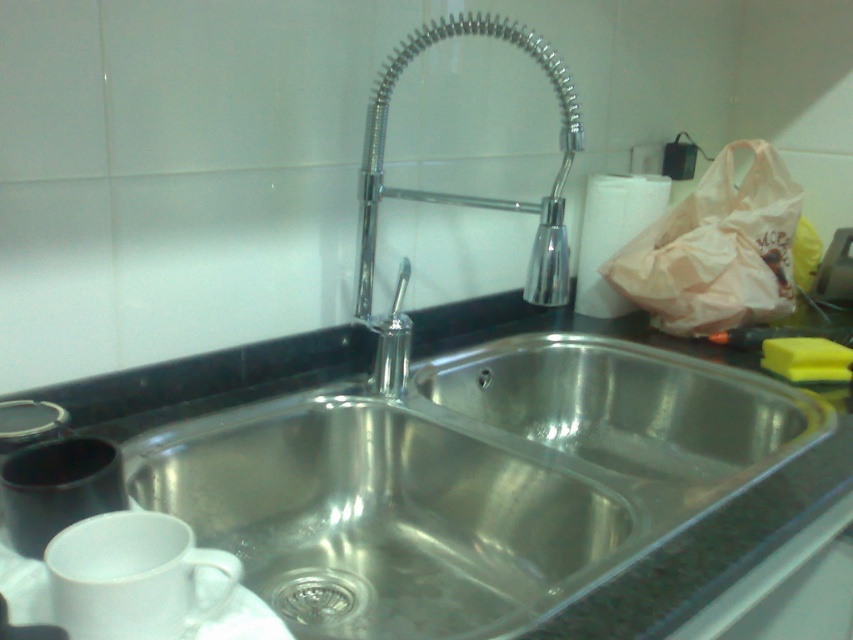
Question: Is stainless steel sink at center smaller than brushed metal drain at center?

Choices:
 (A) no
 (B) yes

Answer: (A)

Question: Which object appears farthest from the camera in this image?

Choices:
 (A) brushed metal drain at center
 (B) chrome/metallic faucet at center
 (C) stainless steel sink at center

Answer: (A)

Question: Is stainless steel sink at center smaller than brushed metal drain at center?

Choices:
 (A) no
 (B) yes

Answer: (A)

Question: Which object appears farthest from the camera in this image?

Choices:
 (A) brushed metal drain at center
 (B) chrome/metallic faucet at center
 (C) stainless steel sink at center

Answer: (A)

Question: Which object is closer to the camera taking this photo?

Choices:
 (A) chrome/metallic faucet at center
 (B) brushed metal drain at center
 (C) stainless steel sink at center

Answer: (C)

Question: Does chrome/metallic faucet at center lie in front of brushed metal drain at center?

Choices:
 (A) yes
 (B) no

Answer: (A)